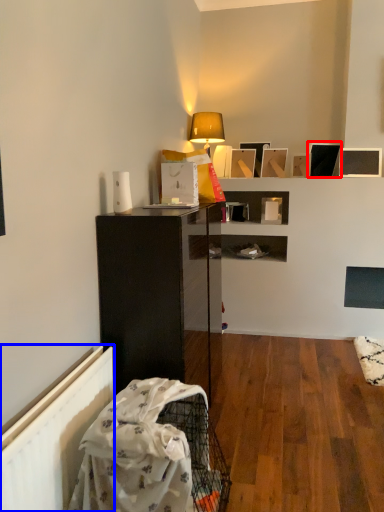
Question: Which point is closer to the camera, picture frame (highlighted by a red box) or radiator (highlighted by a blue box)?

Choices:
 (A) picture frame
 (B) radiator

Answer: (B)